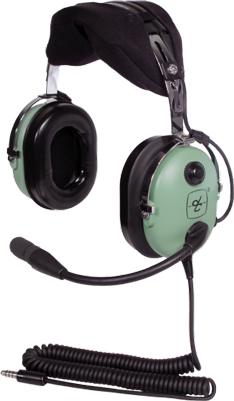
What are the coordinates of `control knob` in the screenshot? It's located at (199, 177).